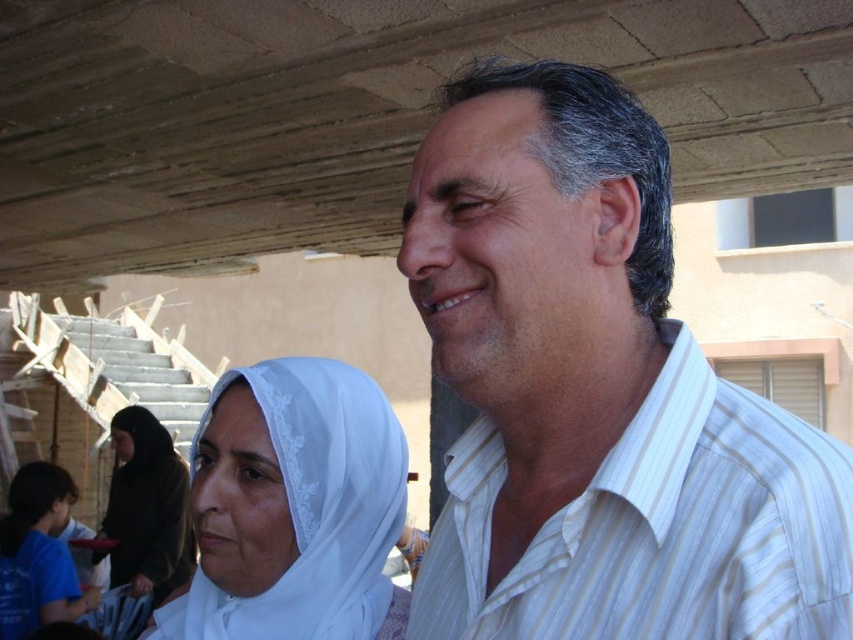
In the scene shown: Which of these two, white lace headscarf at center or white lace hijab at lower left, stands taller?

white lace hijab at lower left is taller.

Between point (235, 451) and point (144, 541), which one is positioned behind?

The point (144, 541) is behind.

The height and width of the screenshot is (640, 853). I want to click on white lace headscarf at center, so click(x=293, y=508).

Does white striped shirt at upper right have a smaller size compared to white lace hijab at lower left?

Yes, white striped shirt at upper right is smaller than white lace hijab at lower left.

Which is in front, point (538, 634) or point (144, 499)?

Point (538, 634) is more forward.

What are the coordinates of `white striped shirt at upper right` in the screenshot? It's located at (596, 394).

From the picture: Measure the distance from white striped shirt at upper right to white lace headscarf at center.

A distance of 15.56 inches exists between white striped shirt at upper right and white lace headscarf at center.

Is the position of white striped shirt at upper right less distant than that of white lace headscarf at center?

Yes, it is in front of white lace headscarf at center.

Does point (439, 253) come farther from viewer compared to point (390, 525)?

No.

Where is `white striped shirt at upper right`? This screenshot has height=640, width=853. white striped shirt at upper right is located at coordinates (596, 394).